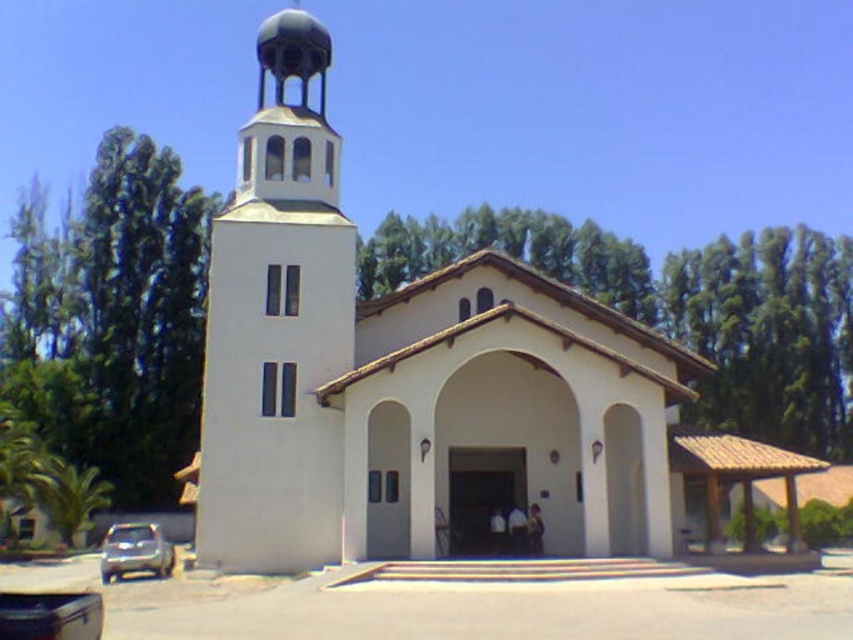
Question: Can you confirm if white smooth church at center is wider than white smooth bell tower at center?

Choices:
 (A) yes
 (B) no

Answer: (A)

Question: Which point appears farthest from the camera in this image?

Choices:
 (A) (201, 502)
 (B) (262, 269)
 (C) (142, 538)

Answer: (B)

Question: Can you confirm if white smooth bell tower at center is bigger than satin silver suv at lower left?

Choices:
 (A) yes
 (B) no

Answer: (A)

Question: Where is white smooth church at center located in relation to white smooth bell tower at center in the image?

Choices:
 (A) above
 (B) below

Answer: (B)

Question: Which object appears farthest from the camera in this image?

Choices:
 (A) satin silver suv at lower left
 (B) white smooth church at center

Answer: (A)

Question: Which object appears closest to the camera in this image?

Choices:
 (A) white smooth bell tower at center
 (B) white smooth church at center

Answer: (B)